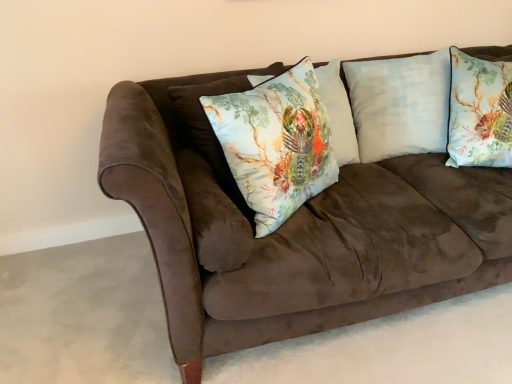
Measure the distance between printed fabric pillow at center, the 3th pillow from the right, and camera.

The depth of printed fabric pillow at center, the 3th pillow from the right, is 1.77 meters.

The width and height of the screenshot is (512, 384). What do you see at coordinates (479, 112) in the screenshot?
I see `textured floral pillow at upper right, the first pillow viewed from the right` at bounding box center [479, 112].

The width and height of the screenshot is (512, 384). Identify the location of suede couch at center. (292, 228).

Is printed fabric cushion at center, the 1th pillow from the left, facing towards textured floral pillow at upper right, the first pillow viewed from the right?

No, printed fabric cushion at center, the 1th pillow from the left, is not turned towards textured floral pillow at upper right, the first pillow viewed from the right.

Based on the photo, is printed fabric cushion at center, which is the fourth pillow in right-to-left order, positioned before textured floral pillow at upper right, the fourth pillow when ordered from left to right?

Yes, it is in front of textured floral pillow at upper right, the fourth pillow when ordered from left to right.

Is printed fabric cushion at center, the 1th pillow from the left, next to textured floral pillow at upper right, the first pillow viewed from the right, and touching it?

There is a gap between printed fabric cushion at center, the 1th pillow from the left, and textured floral pillow at upper right, the first pillow viewed from the right.

Which pillow is the 2nd one when counting from the back of the printed fabric cushion at center, which is the fourth pillow in right-to-left order? Please provide its 2D coordinates.

[(479, 112)]

Which point is more distant from viewer, (160, 104) or (253, 162)?

The point (160, 104) is farther.

In terms of size, does suede couch at center appear bigger or smaller than printed fabric cushion at center, the 1th pillow from the left?

suede couch at center is bigger than printed fabric cushion at center, the 1th pillow from the left.

How different are the orientations of suede couch at center and printed fabric cushion at center, which is the fourth pillow in right-to-left order, in degrees?

34.5 degrees separate the facing orientations of suede couch at center and printed fabric cushion at center, which is the fourth pillow in right-to-left order.

From the image's perspective, relative to printed fabric cushion at center, the 1th pillow from the left, is suede couch at center above or below?

suede couch at center is situated lower than printed fabric cushion at center, the 1th pillow from the left, in the image.

Is printed fabric cushion at center, the 1th pillow from the left, to the left of suede couch at center from the viewer's perspective?

Indeed, printed fabric cushion at center, the 1th pillow from the left, is positioned on the left side of suede couch at center.

Is printed fabric cushion at center, the 1th pillow from the left, taller or shorter than suede couch at center?

printed fabric cushion at center, the 1th pillow from the left, is shorter than suede couch at center.

Is suede couch at center completely or partially inside printed fabric cushion at center, which is the fourth pillow in right-to-left order?

No, suede couch at center is not a part of printed fabric cushion at center, which is the fourth pillow in right-to-left order.

Is light blue cotton pillow at upper right, the second pillow viewed from the right, facing away from printed fabric cushion at center, which is the fourth pillow in right-to-left order?

That's not correct — light blue cotton pillow at upper right, the second pillow viewed from the right, is not looking away from printed fabric cushion at center, which is the fourth pillow in right-to-left order.

Does point (405, 107) appear closer or farther from the camera than point (315, 121)?

Point (405, 107) is positioned farther from the camera compared to point (315, 121).

Who is taller, light blue cotton pillow at upper right, the third pillow from the left, or printed fabric cushion at center, which is the fourth pillow in right-to-left order?

Standing taller between the two is light blue cotton pillow at upper right, the third pillow from the left.

Is light blue cotton pillow at upper right, the second pillow viewed from the right, inside or outside of printed fabric cushion at center, which is the fourth pillow in right-to-left order?

light blue cotton pillow at upper right, the second pillow viewed from the right, exists outside the volume of printed fabric cushion at center, which is the fourth pillow in right-to-left order.

From the image's perspective, between light blue cotton pillow at upper right, the third pillow from the left, and printed fabric pillow at center, arranged as the 2th pillow when viewed from the left, which one is located above?

light blue cotton pillow at upper right, the third pillow from the left, from the image's perspective.

In the scene shown: Is printed fabric pillow at center, the 3th pillow from the right, at the back of light blue cotton pillow at upper right, the second pillow viewed from the right?

No, printed fabric pillow at center, the 3th pillow from the right, is not at the back of light blue cotton pillow at upper right, the second pillow viewed from the right.

Is point (393, 102) positioned after point (333, 104)?

Yes, it is.

Between light blue cotton pillow at upper right, the second pillow viewed from the right, and printed fabric pillow at center, the 3th pillow from the right, which one has smaller width?

light blue cotton pillow at upper right, the second pillow viewed from the right, is thinner.

Which of these two, printed fabric pillow at center, arranged as the 2th pillow when viewed from the left, or light blue cotton pillow at upper right, the second pillow viewed from the right, stands taller?

light blue cotton pillow at upper right, the second pillow viewed from the right, is taller.

Between printed fabric pillow at center, the 3th pillow from the right, and light blue cotton pillow at upper right, the third pillow from the left, which one has smaller width?

light blue cotton pillow at upper right, the third pillow from the left.

From a real-world perspective, which is physically below, printed fabric pillow at center, arranged as the 2th pillow when viewed from the left, or light blue cotton pillow at upper right, the third pillow from the left?

light blue cotton pillow at upper right, the third pillow from the left.

Could you tell me if printed fabric pillow at center, arranged as the 2th pillow when viewed from the left, is facing light blue cotton pillow at upper right, the second pillow viewed from the right?

No, printed fabric pillow at center, arranged as the 2th pillow when viewed from the left, is not aimed at light blue cotton pillow at upper right, the second pillow viewed from the right.

Would you say printed fabric pillow at center, the 3th pillow from the right, is part of printed fabric cushion at center, which is the fourth pillow in right-to-left order,'s contents?

No, printed fabric pillow at center, the 3th pillow from the right, is not a part of printed fabric cushion at center, which is the fourth pillow in right-to-left order.

From a real-world perspective, is printed fabric cushion at center, which is the fourth pillow in right-to-left order, positioned over printed fabric pillow at center, arranged as the 2th pillow when viewed from the left, based on gravity?

Indeed, from a real-world perspective, printed fabric cushion at center, which is the fourth pillow in right-to-left order, stands above printed fabric pillow at center, arranged as the 2th pillow when viewed from the left.

Is printed fabric cushion at center, the 1th pillow from the left, oriented away from printed fabric pillow at center, the 3th pillow from the right?

No.

Locate an element on the screen. The height and width of the screenshot is (384, 512). the 3rd pillow to the right when counting from the printed fabric cushion at center, the 1th pillow from the left is located at coordinates (479, 112).

The height and width of the screenshot is (384, 512). Identify the location of studio couch below the printed fabric cushion at center, the 1th pillow from the left (from a real-world perspective). (292, 228).

In the scene shown: Based on their spatial positions, is suede couch at center or light blue cotton pillow at upper right, the second pillow viewed from the right, closer to printed fabric cushion at center, which is the fourth pillow in right-to-left order?

suede couch at center.

Looking at the image, which one is located further to printed fabric pillow at center, arranged as the 2th pillow when viewed from the left, printed fabric cushion at center, the 1th pillow from the left, or light blue cotton pillow at upper right, the third pillow from the left?

printed fabric cushion at center, the 1th pillow from the left, lies further to printed fabric pillow at center, arranged as the 2th pillow when viewed from the left, than the other object.

Which object lies further to the anchor point light blue cotton pillow at upper right, the third pillow from the left, printed fabric pillow at center, the 3th pillow from the right, or printed fabric cushion at center, which is the fourth pillow in right-to-left order?

printed fabric cushion at center, which is the fourth pillow in right-to-left order.

Looking at the image, which one is located further to light blue cotton pillow at upper right, the second pillow viewed from the right, textured floral pillow at upper right, the fourth pillow when ordered from left to right, or suede couch at center?

suede couch at center lies further to light blue cotton pillow at upper right, the second pillow viewed from the right, than the other object.

Estimate the real-world distances between objects in this image. Which object is further from printed fabric pillow at center, arranged as the 2th pillow when viewed from the left, textured floral pillow at upper right, the fourth pillow when ordered from left to right, or suede couch at center?

The object further to printed fabric pillow at center, arranged as the 2th pillow when viewed from the left, is suede couch at center.

Estimate the real-world distances between objects in this image. Which object is further from printed fabric pillow at center, the 3th pillow from the right, light blue cotton pillow at upper right, the third pillow from the left, or printed fabric cushion at center, which is the fourth pillow in right-to-left order?

Based on the image, printed fabric cushion at center, which is the fourth pillow in right-to-left order, appears to be further to printed fabric pillow at center, the 3th pillow from the right.

Estimate the real-world distances between objects in this image. Which object is closer to textured floral pillow at upper right, the first pillow viewed from the right, light blue cotton pillow at upper right, the third pillow from the left, or suede couch at center?

light blue cotton pillow at upper right, the third pillow from the left, lies closer to textured floral pillow at upper right, the first pillow viewed from the right, than the other object.

Considering their positions, is printed fabric pillow at center, arranged as the 2th pillow when viewed from the left, positioned further to light blue cotton pillow at upper right, the third pillow from the left, than suede couch at center?

suede couch at center lies further to light blue cotton pillow at upper right, the third pillow from the left, than the other object.

The width and height of the screenshot is (512, 384). I want to click on pillow between suede couch at center and printed fabric pillow at center, the 3th pillow from the right, from front to back, so click(x=276, y=143).

Where is `pillow located between printed fabric pillow at center, the 3th pillow from the right, and textured floral pillow at upper right, the fourth pillow when ordered from left to right, in the left-right direction`? pillow located between printed fabric pillow at center, the 3th pillow from the right, and textured floral pillow at upper right, the fourth pillow when ordered from left to right, in the left-right direction is located at coordinates (400, 104).

Identify the location of studio couch between printed fabric cushion at center, the 1th pillow from the left, and textured floral pillow at upper right, the fourth pillow when ordered from left to right. The image size is (512, 384). (292, 228).

This screenshot has height=384, width=512. Identify the location of studio couch located between printed fabric pillow at center, the 3th pillow from the right, and textured floral pillow at upper right, the first pillow viewed from the right, in the left-right direction. (292, 228).